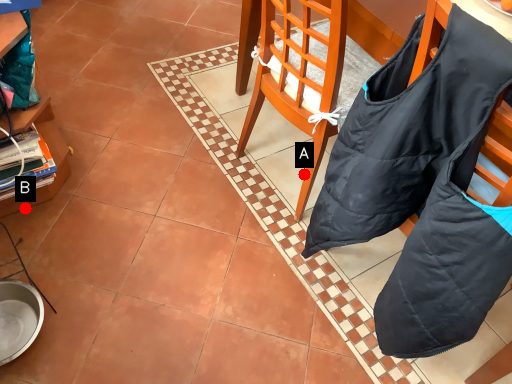
Question: Two points are circled on the image, labeled by A and B beside each circle. Which point appears farthest from the camera in this image?

Choices:
 (A) A is further
 (B) B is further

Answer: (A)